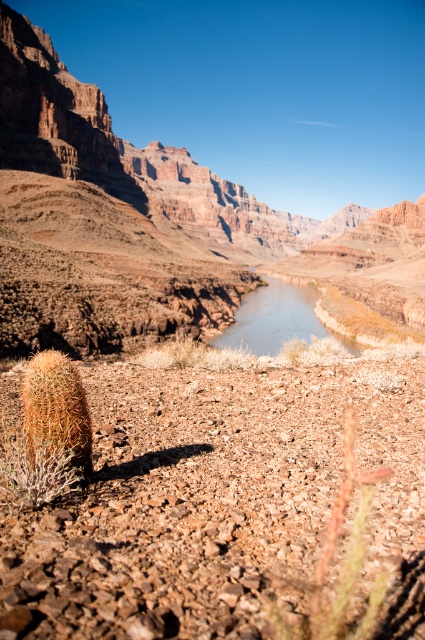
How far apart are brown rocky canyon at center and brown fuzzy cactus at lower center?

A distance of 350.85 meters exists between brown rocky canyon at center and brown fuzzy cactus at lower center.

Is brown rocky canyon at center bigger than brown fuzzy cactus at lower center?

Yes.

Between point (328, 250) and point (345, 435), which one is positioned in front?

Positioned in front is point (345, 435).

Locate an element on the screen. This screenshot has height=640, width=425. brown rocky canyon at center is located at coordinates (127, 173).

What do you see at coordinates (127, 173) in the screenshot? I see `brown rocky canyon at center` at bounding box center [127, 173].

Is point (61, 90) closer to viewer compared to point (308, 324)?

No, it is behind (308, 324).

Does point (5, 353) lie in front of point (254, 324)?

Yes, point (5, 353) is in front of point (254, 324).

Where is `brown rocky canyon at center`? The width and height of the screenshot is (425, 640). brown rocky canyon at center is located at coordinates (127, 173).

Which is below, orange spiny cactus at lower left or clear water at center?

Positioned lower is orange spiny cactus at lower left.

Does orange spiny cactus at lower left have a smaller size compared to clear water at center?

Correct, orange spiny cactus at lower left occupies less space than clear water at center.

Who is more distant from viewer, (53, 442) or (237, 316)?

The point (237, 316) is more distant.

The image size is (425, 640). I want to click on orange spiny cactus at lower left, so click(x=56, y=408).